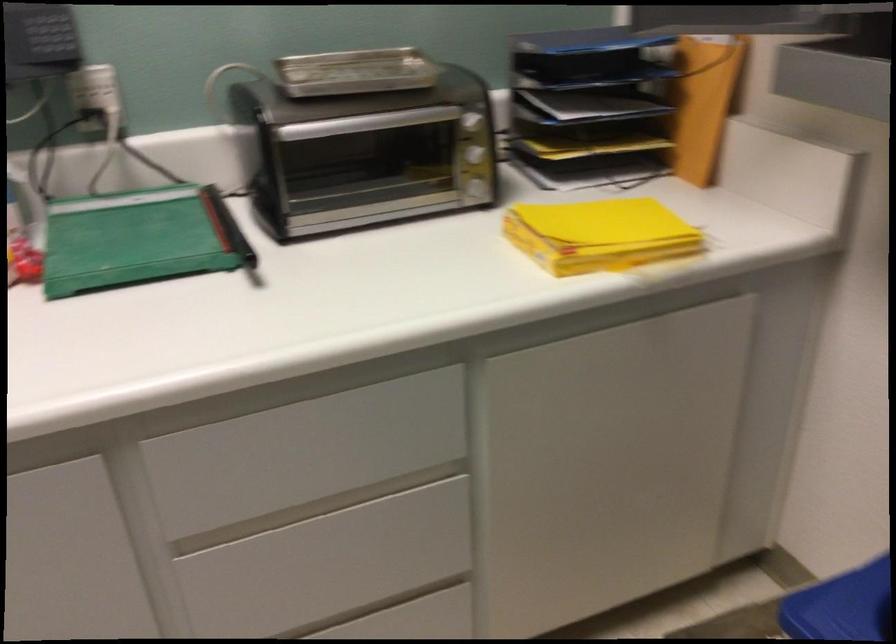
This screenshot has height=644, width=896. I want to click on metal tray, so click(355, 71).